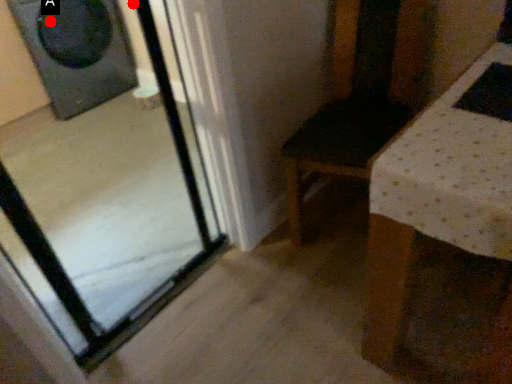
Question: Two points are circled on the image, labeled by A and B beside each circle. Which point appears closest to the camera in this image?

Choices:
 (A) A is closer
 (B) B is closer

Answer: (A)